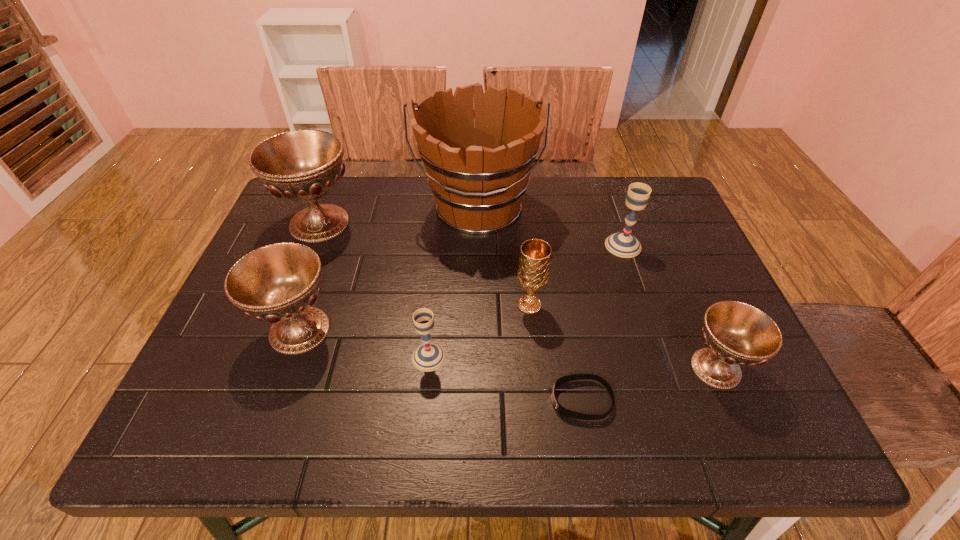
Find the location of a particular element. Image resolution: width=960 pixels, height=540 pixels. wristband is located at coordinates (563, 411).

Identify the location of vacant region located 0.100m with the handle on the tallest object. The height and width of the screenshot is (540, 960). (477, 274).

At what (x,y) coordinates should I click in order to perform the action: click on vacant region located 0.210m on the right of the farthest red chalice. Please return your answer as a coordinate pair (x, y). Looking at the image, I should click on (x=435, y=223).

Locate an element on the screen. The width and height of the screenshot is (960, 540). free space located on the left of the bigger gray chalice is located at coordinates (530, 246).

At what (x,y) coordinates should I click in order to perform the action: click on vacant space situated on the back of the second biggest red chalice. Please return your answer as a coordinate pair (x, y). The width and height of the screenshot is (960, 540). Looking at the image, I should click on (331, 240).

Locate an element on the screen. The height and width of the screenshot is (540, 960). vacant space positioned 0.220m on the left of the fourth chalice from left to right is located at coordinates (420, 305).

Locate an element on the screen. The width and height of the screenshot is (960, 540). free space located on the right of the smaller gray chalice is located at coordinates (532, 357).

I want to click on vacant area located 0.380m on the left of the smallest red chalice, so [498, 368].

Locate an element on the screen. The height and width of the screenshot is (540, 960). vacant position located on the display of the shortest object is located at coordinates (422, 400).

Image resolution: width=960 pixels, height=540 pixels. Identify the location of blank area located 0.140m on the display of the shortest object. (479, 400).